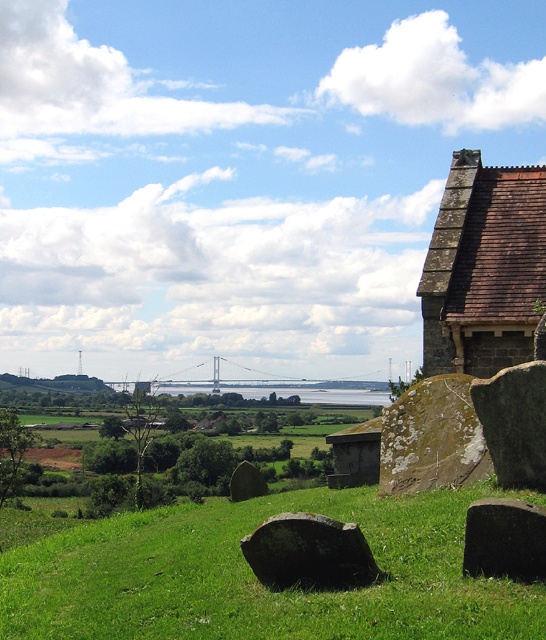
Question: Is green grassy at lower center below dark gray stone boulder at center?

Choices:
 (A) yes
 (B) no

Answer: (A)

Question: Which of the following is the farthest from the observer?

Choices:
 (A) green grassy at lower center
 (B) green mossy stone at lower right
 (C) smooth gray rock at center

Answer: (C)

Question: Does brown shingled roof at upper right appear on the left side of dark gray stone boulder at center?

Choices:
 (A) yes
 (B) no

Answer: (B)

Question: Estimate the real-world distances between objects in this image. Which object is farther from the dark gray stone boulder at center?

Choices:
 (A) green mossy stone at lower right
 (B) green grassy at lower center
 (C) smooth gray rock at center
 (D) black smooth stone at lower right

Answer: (C)

Question: Is black smooth stone at lower right below smooth gray rock at center?

Choices:
 (A) no
 (B) yes

Answer: (A)

Question: Which object is the farthest from the brown shingled roof at upper right?

Choices:
 (A) black smooth stone at lower right
 (B) white lichen-covered stone at center-right

Answer: (A)